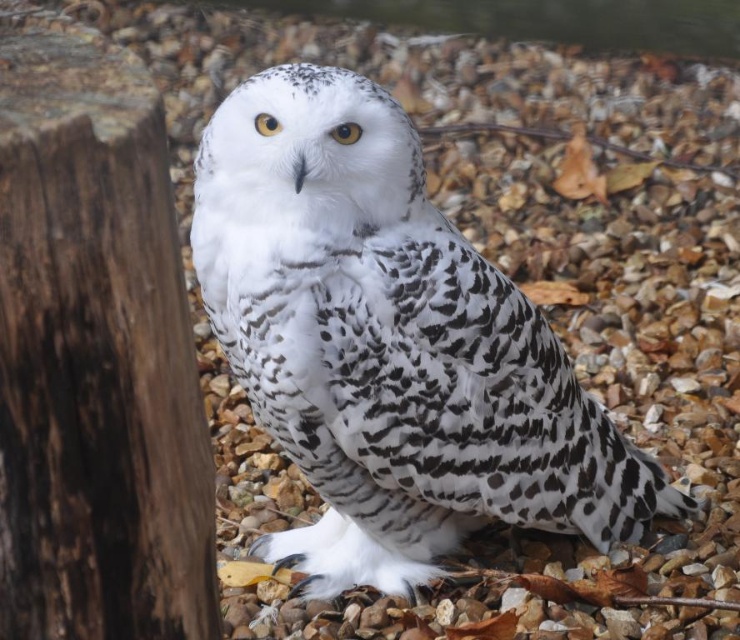
Question: Is white speckled owl at center wider than dark brown rough wood at left?

Choices:
 (A) yes
 (B) no

Answer: (A)

Question: Which object appears closest to the camera in this image?

Choices:
 (A) dark brown rough wood at left
 (B) white speckled owl at center

Answer: (A)

Question: Among these points, which one is nearest to the camera?

Choices:
 (A) (371, 166)
 (B) (84, 61)

Answer: (B)

Question: Does white speckled owl at center have a greater width compared to dark brown rough wood at left?

Choices:
 (A) no
 (B) yes

Answer: (B)

Question: Does white speckled owl at center have a lesser width compared to dark brown rough wood at left?

Choices:
 (A) no
 (B) yes

Answer: (A)